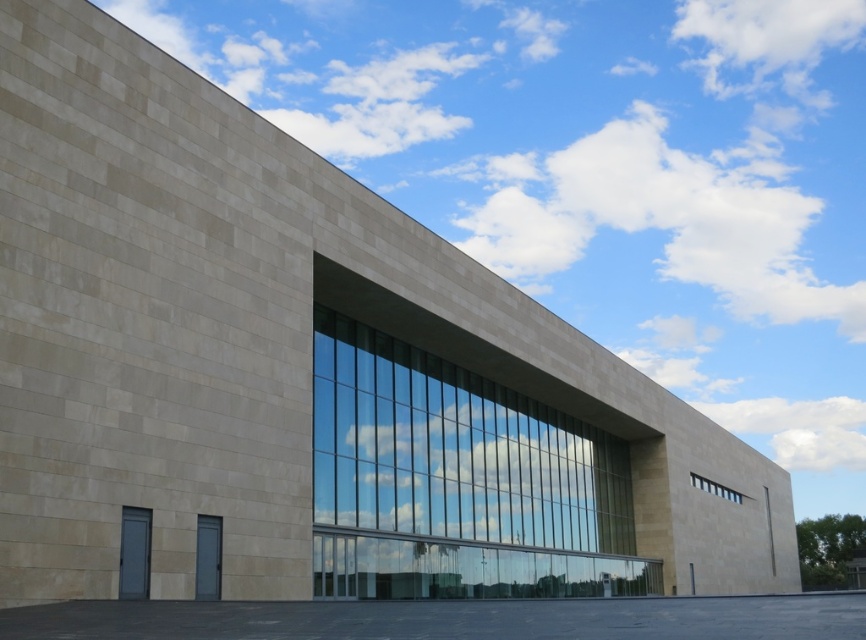
Which is in front, point (406, 502) or point (693, 474)?

Point (406, 502)

Who is more distant from viewer, (318, 420) or (705, 483)?

The point (705, 483) is behind.

Measure the distance between point (353,445) and camera.

Point (353,445) is 27.67 meters from camera.

Find the location of a particular element. transparent glass window at center is located at coordinates (457, 481).